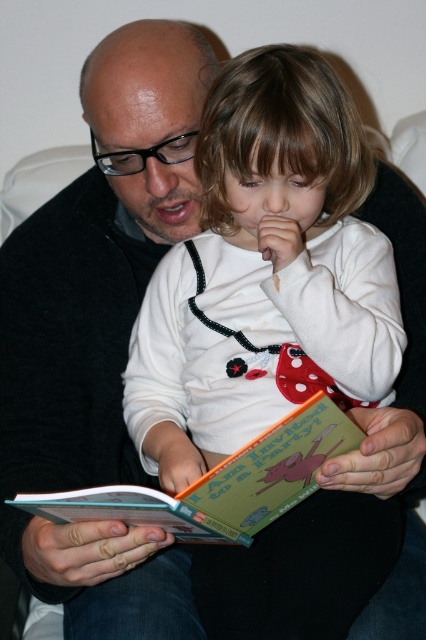
Between point (302, 246) and point (209, 522), which one is positioned in front?

Point (209, 522)

Does white soft fabric shirt at center have a smaller size compared to hardcover book at center?

No, white soft fabric shirt at center is not smaller than hardcover book at center.

Between point (394, 272) and point (293, 442), which one is positioned behind?

Point (394, 272)

Where is `white soft fabric shirt at center`? This screenshot has width=426, height=640. white soft fabric shirt at center is located at coordinates (265, 273).